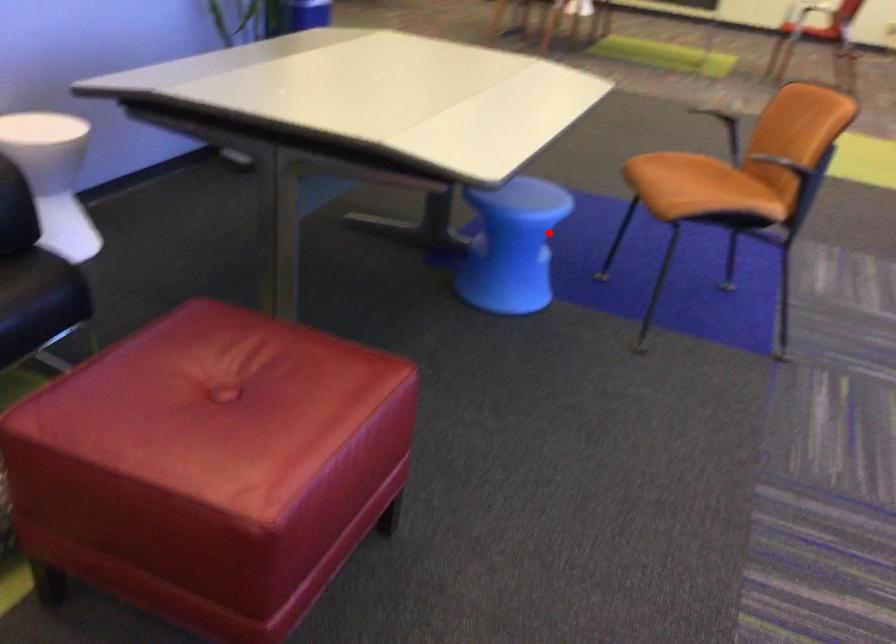
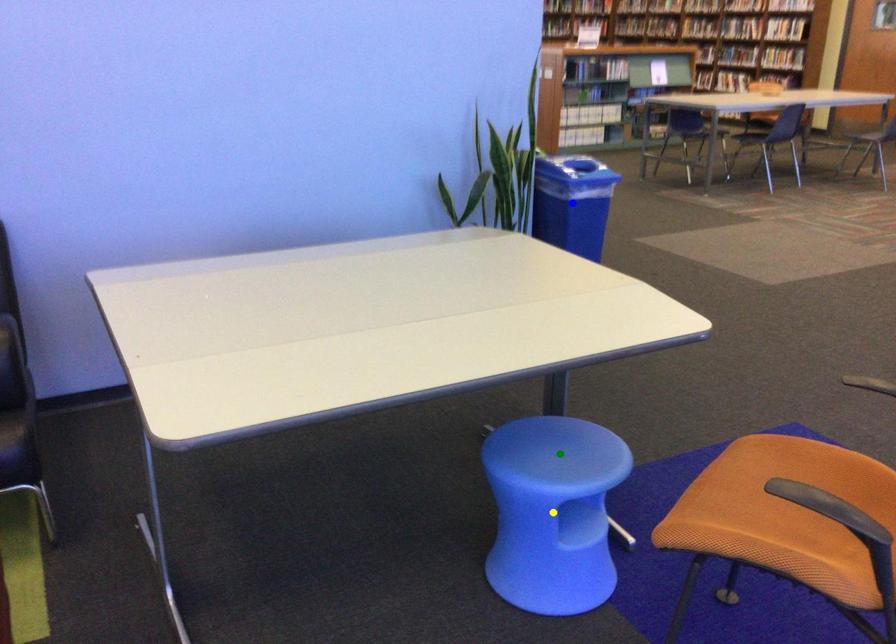
Question: I am providing you with two images of the same scene from different viewpoints. A red point is marked on the first image. You are given multiple points on the second image. Which point in image 2 is actually the same real-world point as the red point in image 1?

Choices:
 (A) blue point
 (B) green point
 (C) yellow point

Answer: (C)